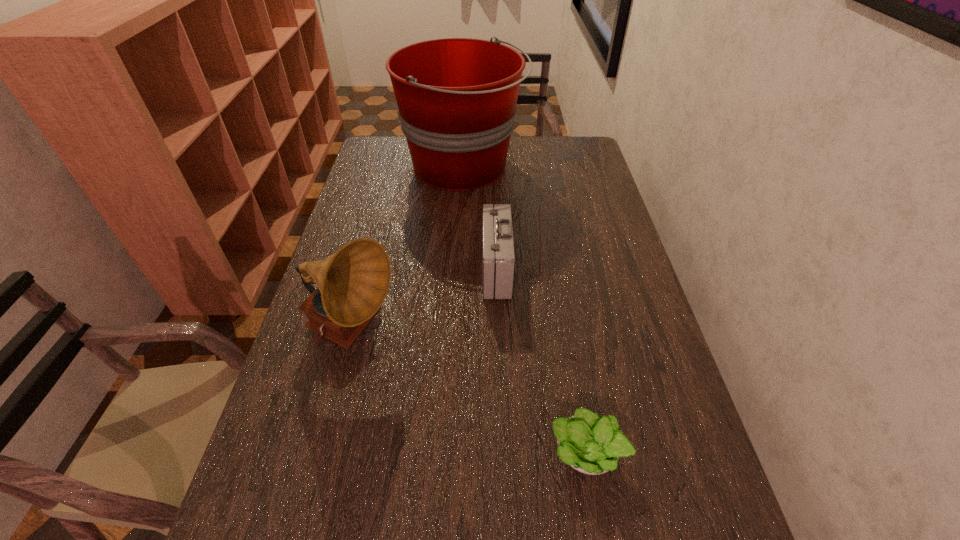
At what (x,y) coordinates should I click in order to perform the action: click on vacant area located on the front-facing side of the second shortest object. Please return your answer as a coordinate pair (x, y). Looking at the image, I should click on (350, 269).

I want to click on vacant position located on the left of the nearest object, so click(466, 453).

This screenshot has height=540, width=960. Find the location of `object that is at the far edge`. object that is at the far edge is located at coordinates (456, 97).

Image resolution: width=960 pixels, height=540 pixels. I want to click on bucket present at the left edge, so [x=456, y=97].

Locate an element on the screen. The width and height of the screenshot is (960, 540). phonograph record that is at the left edge is located at coordinates (352, 284).

Locate an element on the screen. object located in the right edge section of the desktop is located at coordinates click(590, 444).

Find the location of a particular element. Image resolution: width=960 pixels, height=540 pixels. object that is at the far left corner is located at coordinates (456, 97).

Locate an element on the screen. vacant space at the left edge of the desktop is located at coordinates (343, 219).

In the image, there is a desktop. At what (x,y) coordinates should I click in order to perform the action: click on vacant space at the right edge. Please return your answer as a coordinate pair (x, y). Looking at the image, I should click on (628, 472).

Where is `free space at the far right corner of the desktop`? The height and width of the screenshot is (540, 960). free space at the far right corner of the desktop is located at coordinates [586, 156].